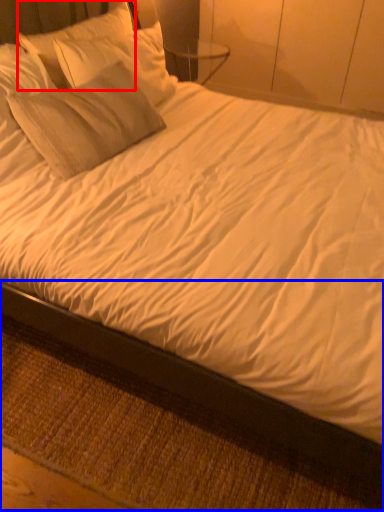
Question: Which point is closer to the camera, pillow (highlighted by a red box) or bed frame (highlighted by a blue box)?

Choices:
 (A) pillow
 (B) bed frame

Answer: (B)